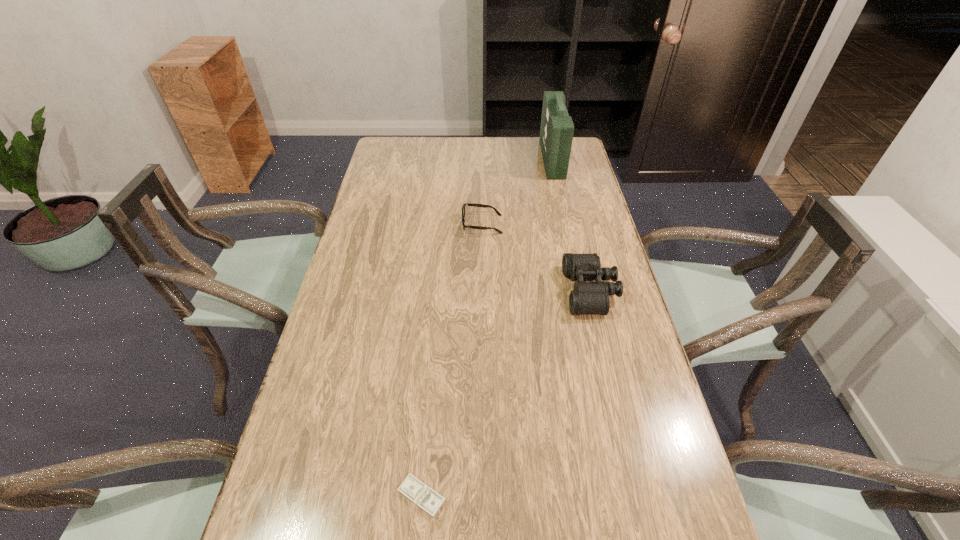
Where is `vacant space that satisfies the following two spatial constraints: 1. on the front-facing side of the tallest object; 2. on the front side of the money`? The height and width of the screenshot is (540, 960). vacant space that satisfies the following two spatial constraints: 1. on the front-facing side of the tallest object; 2. on the front side of the money is located at coordinates (627, 496).